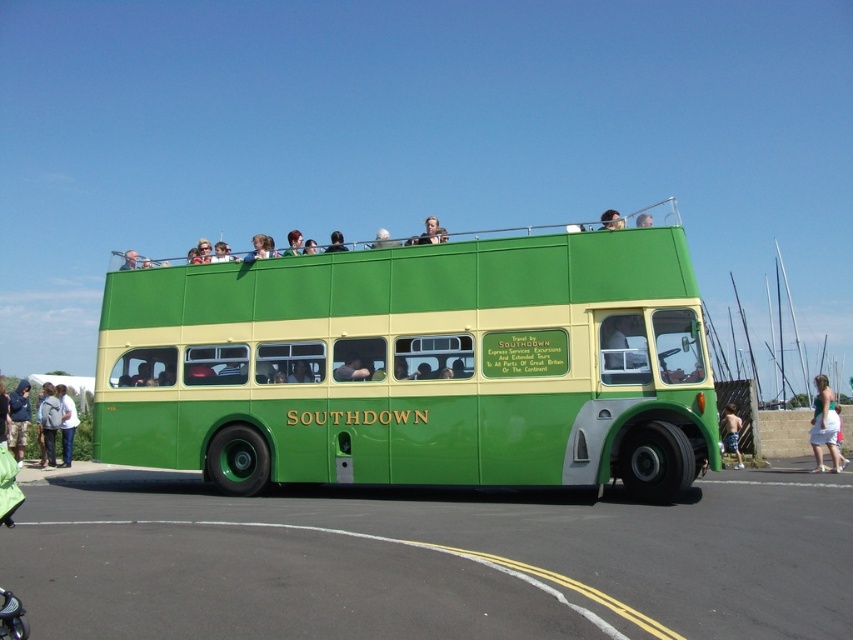
Which is above, light blue jeans at lower left or blue denim shorts at lower right?

Positioned higher is light blue jeans at lower left.

The height and width of the screenshot is (640, 853). What do you see at coordinates (67, 422) in the screenshot?
I see `light blue jeans at lower left` at bounding box center [67, 422].

Locate an element on the screen. light blue jeans at lower left is located at coordinates click(67, 422).

Is white cotton skirt at lower right bigger than light gray backpack at lower left?

Indeed, white cotton skirt at lower right has a larger size compared to light gray backpack at lower left.

Is white cotton skirt at lower right to the right of light gray backpack at lower left from the viewer's perspective?

Indeed, white cotton skirt at lower right is positioned on the right side of light gray backpack at lower left.

Is point (827, 428) behind point (50, 401)?

No, (827, 428) is closer to viewer.

Find the location of a particular element. The width and height of the screenshot is (853, 640). white cotton skirt at lower right is located at coordinates (824, 426).

This screenshot has width=853, height=640. In order to click on dark blue jacket at lower left in this screenshot , I will do `click(18, 419)`.

Does point (15, 429) lie behind point (51, 401)?

No, it is not.

Is point (26, 433) closer to camera compared to point (42, 410)?

Yes, it is in front of point (42, 410).

Identify the location of dark blue jacket at lower left. The image size is (853, 640). (18, 419).